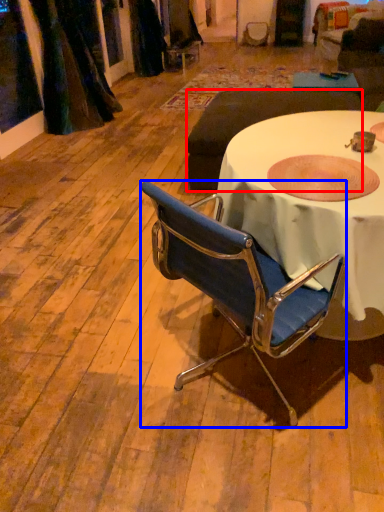
Question: Which object is closer to the camera taking this photo, studio couch (highlighted by a red box) or chair (highlighted by a blue box)?

Choices:
 (A) studio couch
 (B) chair

Answer: (B)